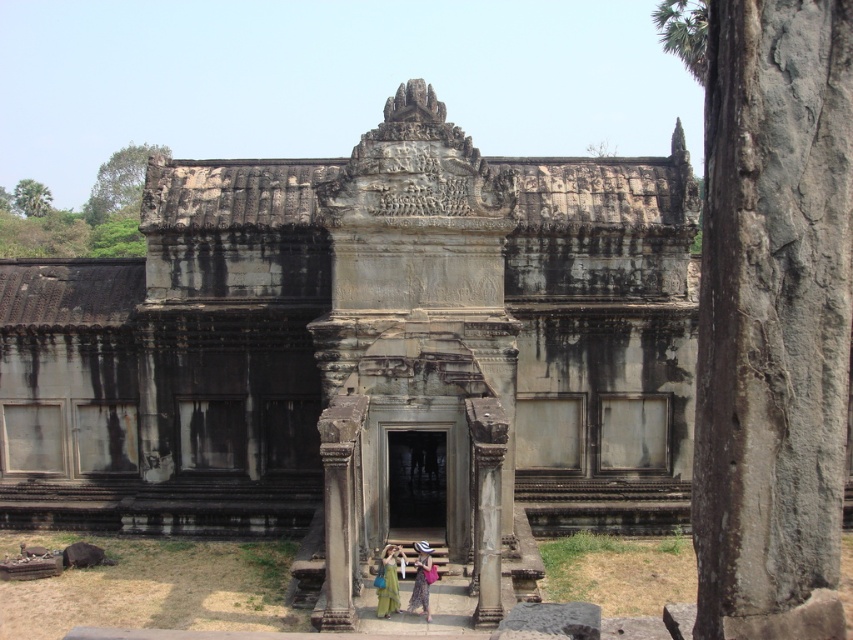
Is gray stone ruins at center thinner than gray stone pillar at center?

In fact, gray stone ruins at center might be wider than gray stone pillar at center.

Which of these two, gray stone ruins at center or gray stone pillar at center, stands shorter?

Standing shorter between the two is gray stone pillar at center.

Is point (433, 218) farther from viewer compared to point (728, 593)?

Yes, point (433, 218) is behind point (728, 593).

You are a GUI agent. You are given a task and a screenshot of the screen. Output one action in this format:
    pyautogui.click(x=<x>, y=<y>)
    Task: Click on the gray stone ruins at center
    The height and width of the screenshot is (640, 853).
    Given the screenshot: What is the action you would take?
    pyautogui.click(x=358, y=348)

Consider the image. Who is more forward, (351,348) or (415,584)?

Positioned in front is point (415,584).

Between gray stone ruins at center and green dress at center, which one is positioned higher?

gray stone ruins at center is higher up.

Is point (416, 435) closer to camera compared to point (413, 604)?

No.

Locate an element on the screen. This screenshot has width=853, height=640. gray stone ruins at center is located at coordinates (358, 348).

Who is positioned more to the right, gray stone pillar at center or green silk dress at center?

Positioned to the right is gray stone pillar at center.

Is point (781, 124) positioned after point (393, 588)?

No.

Is point (747, 618) positioned after point (401, 552)?

No, it is in front of (401, 552).

Locate an element on the screen. gray stone pillar at center is located at coordinates (773, 320).